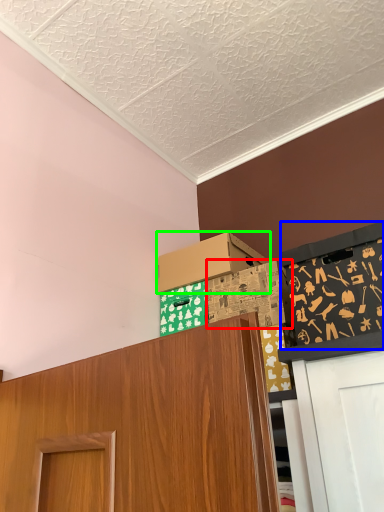
Question: Considering the real-world distances, which object is farthest from box (highlighted by a red box)? bulletin board (highlighted by a blue box) or box (highlighted by a green box)?

Choices:
 (A) bulletin board
 (B) box

Answer: (A)